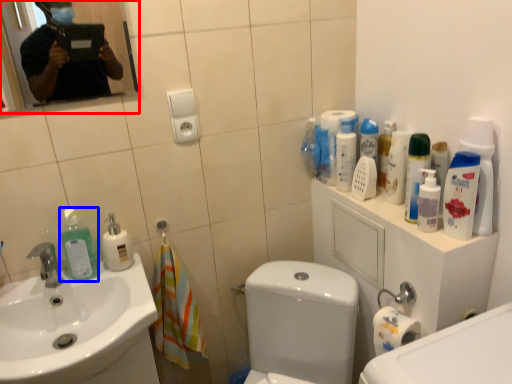
Question: Which point is further to the camera, mirror (highlighted by a red box) or cleaning product (highlighted by a blue box)?

Choices:
 (A) mirror
 (B) cleaning product

Answer: (B)